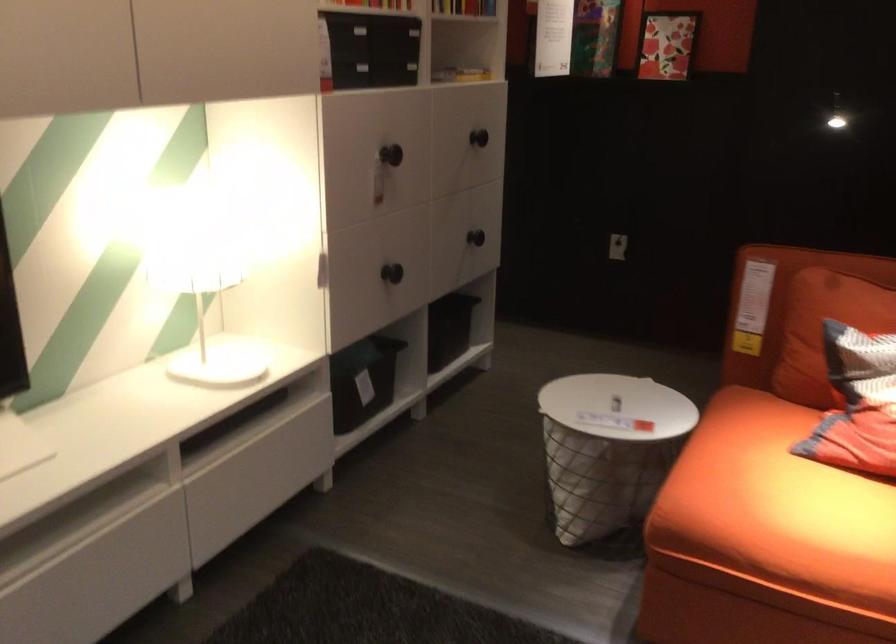
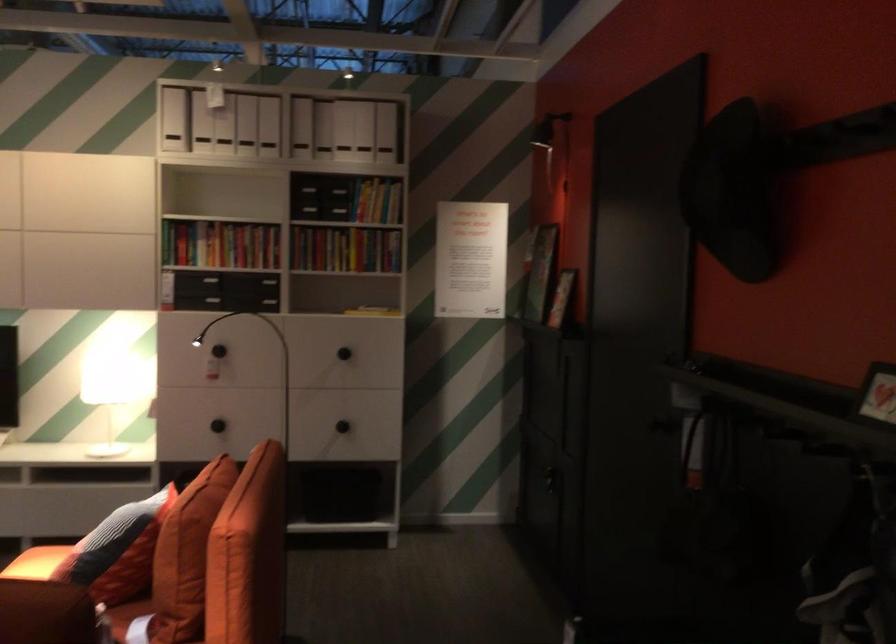
Locate, in the second image, the point that corresponds to the point at 804,469 in the first image.

(36, 563)